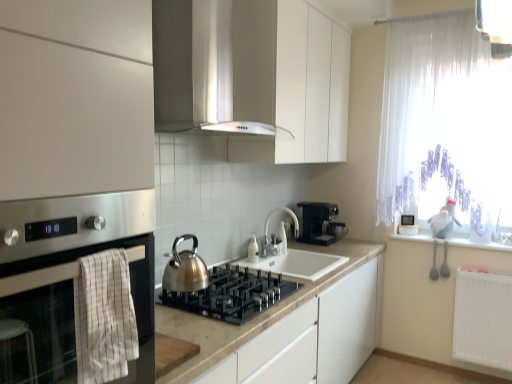
Question: Is white sheer curtain at right located within black plastic coffee machine at center?

Choices:
 (A) no
 (B) yes

Answer: (A)

Question: From the image's perspective, is black plastic coffee machine at center on top of white sheer curtain at right?

Choices:
 (A) yes
 (B) no

Answer: (B)

Question: From a real-world perspective, is black plastic coffee machine at center beneath white sheer curtain at right?

Choices:
 (A) no
 (B) yes

Answer: (B)

Question: From the image's perspective, does black plastic coffee machine at center appear lower than white sheer curtain at right?

Choices:
 (A) no
 (B) yes

Answer: (B)

Question: Is black plastic coffee machine at center thinner than white sheer curtain at right?

Choices:
 (A) yes
 (B) no

Answer: (B)

Question: Considering their positions, is black plastic coffee machine at center located in front of or behind white glossy faucet at center?

Choices:
 (A) behind
 (B) front

Answer: (A)

Question: From the image's perspective, is black plastic coffee machine at center positioned above or below white glossy faucet at center?

Choices:
 (A) above
 (B) below

Answer: (A)

Question: From a real-world perspective, is black plastic coffee machine at center physically located above or below white glossy faucet at center?

Choices:
 (A) below
 (B) above

Answer: (A)

Question: Does point (334, 223) appear closer or farther from the camera than point (291, 218)?

Choices:
 (A) closer
 (B) farther

Answer: (B)

Question: From the image's perspective, is black glass gas stove at center positioned above or below white plastic radiator at lower right?

Choices:
 (A) above
 (B) below

Answer: (A)

Question: Relative to white plastic radiator at lower right, is black glass gas stove at center in front or behind?

Choices:
 (A) front
 (B) behind

Answer: (A)

Question: Which is correct: black glass gas stove at center is inside white plastic radiator at lower right, or outside of it?

Choices:
 (A) inside
 (B) outside

Answer: (B)

Question: Does point (180, 301) appear closer or farther from the camera than point (460, 309)?

Choices:
 (A) farther
 (B) closer

Answer: (B)

Question: Considering the positions of point (65, 231) and point (267, 218), is point (65, 231) closer or farther from the camera than point (267, 218)?

Choices:
 (A) closer
 (B) farther

Answer: (A)

Question: Considering the positions of stainless steel oven at left and white glossy faucet at center in the image, is stainless steel oven at left wider or thinner than white glossy faucet at center?

Choices:
 (A) thin
 (B) wide

Answer: (B)